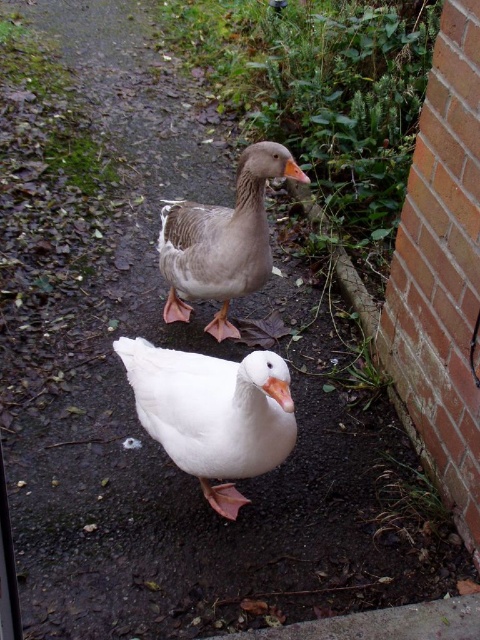
Question: Which point is closer to the camera taking this photo?

Choices:
 (A) (247, 227)
 (B) (135, 396)

Answer: (B)

Question: Can you confirm if white matte duck at center is positioned to the right of gray matte duck at center?

Choices:
 (A) yes
 (B) no

Answer: (B)

Question: Considering the relative positions of white matte duck at center and gray matte duck at center in the image provided, where is white matte duck at center located with respect to gray matte duck at center?

Choices:
 (A) right
 (B) left

Answer: (B)

Question: Which object appears closest to the camera in this image?

Choices:
 (A) gray matte duck at center
 (B) white matte duck at center

Answer: (B)

Question: Does white matte duck at center appear on the left side of gray matte duck at center?

Choices:
 (A) yes
 (B) no

Answer: (A)